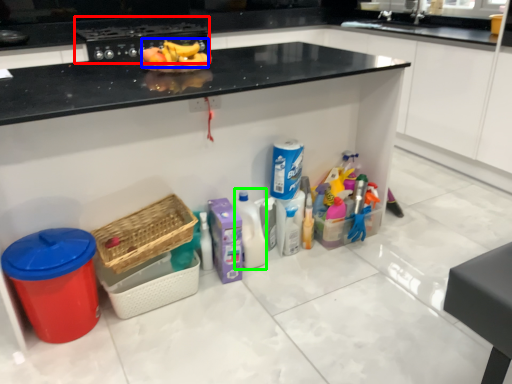
Question: Based on their relative distances, which object is nearer to appliance (highlighted by a red box)? Choose from fruit (highlighted by a blue box) and cleaning product (highlighted by a green box).

Choices:
 (A) fruit
 (B) cleaning product

Answer: (A)